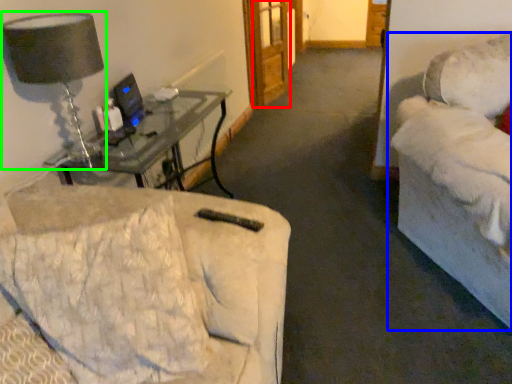
Question: Considering the real-world distances, which object is farthest from glass door (highlighted by a red box)? studio couch (highlighted by a blue box) or table lamp (highlighted by a green box)?

Choices:
 (A) studio couch
 (B) table lamp

Answer: (B)